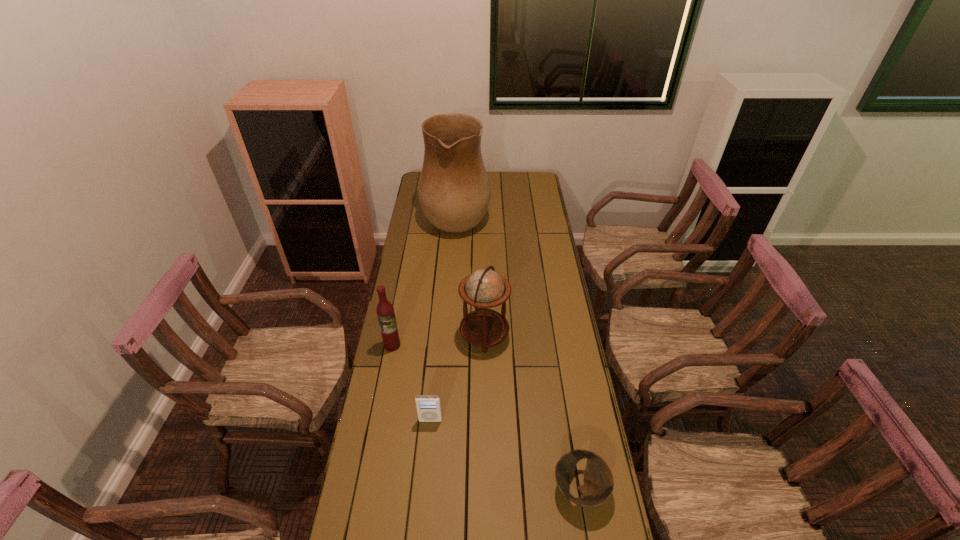
Identify the location of free space at the far edge of the desktop. (510, 173).

Find the location of a particular element. The image size is (960, 540). vacant space at the left edge of the desktop is located at coordinates (431, 274).

You are a GUI agent. You are given a task and a screenshot of the screen. Output one action in this format:
    pyautogui.click(x=<x>, y=<y>)
    Task: Click on the free space at the right edge of the desktop
    
    Given the screenshot: What is the action you would take?
    pyautogui.click(x=540, y=227)

In order to click on vacant area that lies between the second nearest object and the leftmost object in this screenshot , I will do `click(411, 383)`.

At what (x,y) coordinates should I click in order to perform the action: click on vacant space in between the farthest object and the liquor. Please return your answer as a coordinate pair (x, y). The width and height of the screenshot is (960, 540). Looking at the image, I should click on (424, 280).

Where is `vacant space that's between the leftmost object and the shortest object`? vacant space that's between the leftmost object and the shortest object is located at coordinates (486, 417).

Locate an element on the screen. This screenshot has width=960, height=540. vacant space that is in between the liquor and the rightmost object is located at coordinates (486, 417).

Where is `free space between the globe and the nearest object`? free space between the globe and the nearest object is located at coordinates (532, 412).

Find the location of a particular element. This screenshot has height=540, width=960. blank region between the iPod and the farthest object is located at coordinates (444, 318).

Where is `vacant space that is in between the farthest object and the leftmost object`? The height and width of the screenshot is (540, 960). vacant space that is in between the farthest object and the leftmost object is located at coordinates (424, 280).